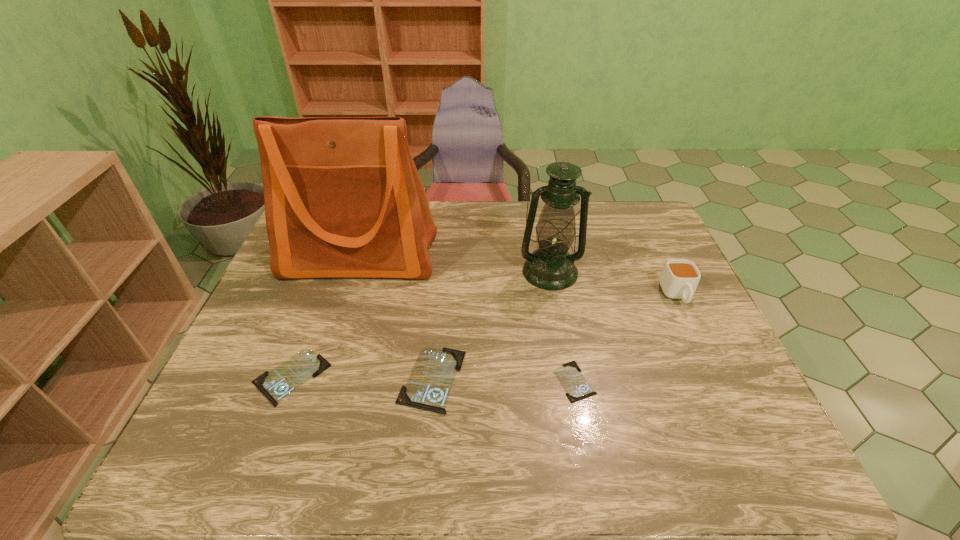
Locate an element on the screen. blank region between the fifth shortest object and the second shortest object is located at coordinates (420, 324).

At what (x,y) coordinates should I click in order to perform the action: click on vacant space that's between the oil lamp and the rightmost object. Please return your answer as a coordinate pair (x, y). Looking at the image, I should click on (613, 284).

This screenshot has width=960, height=540. I want to click on empty location between the fifth tallest object and the oil lamp, so click(420, 324).

Image resolution: width=960 pixels, height=540 pixels. Identify the location of free space that is in between the leftmost identity card and the second identity card from left to right. (362, 378).

The width and height of the screenshot is (960, 540). Identify the location of free point between the shortest object and the tallest object. (468, 320).

This screenshot has height=540, width=960. Find the location of `object that ranks as the second closest to the third tallest object`. object that ranks as the second closest to the third tallest object is located at coordinates (577, 388).

Where is `object that is the closest to the second identity card from right to left`? This screenshot has width=960, height=540. object that is the closest to the second identity card from right to left is located at coordinates (275, 385).

Where is `identity card that stands as the second closest to the fifth shortest object`? Image resolution: width=960 pixels, height=540 pixels. identity card that stands as the second closest to the fifth shortest object is located at coordinates (428, 387).

Choose which identity card is the second nearest neighbor to the second shortest identity card. Please provide its 2D coordinates. Your answer should be formatted as a tuple, i.e. [(x, y)], where the tuple contains the x and y coordinates of a point satisfying the conditions above.

[(577, 388)]

Find the location of a particular element. The image size is (960, 540). vacant position in the image that satisfies the following two spatial constraints: 1. on the front pocket of the second identity card from left to right; 2. on the left side of the tallest object is located at coordinates (322, 379).